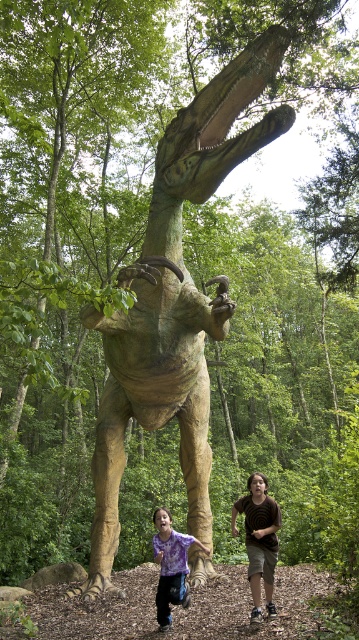
In the scene shown: Which is more to the right, green textured dinosaur at center or brown cotton shirt at lower center?

From the viewer's perspective, brown cotton shirt at lower center appears more on the right side.

The height and width of the screenshot is (640, 359). What do you see at coordinates (174, 301) in the screenshot?
I see `green textured dinosaur at center` at bounding box center [174, 301].

Does point (113, 403) come farther from viewer compared to point (259, 483)?

Yes, it is.

This screenshot has height=640, width=359. Find the location of `green textured dinosaur at center`. green textured dinosaur at center is located at coordinates (174, 301).

Between point (216, 163) and point (152, 520), which one is positioned behind?

Positioned behind is point (152, 520).

Does green textured dinosaur at center have a greater height compared to purple tie-dye shirt at lower center?

Yes, green textured dinosaur at center is taller than purple tie-dye shirt at lower center.

Is point (164, 141) more distant than point (169, 611)?

Yes.

Where is `green textured dinosaur at center`? green textured dinosaur at center is located at coordinates (174, 301).

Between point (257, 509) and point (179, 561), which one is positioned in front?

Positioned in front is point (257, 509).

Is brown cotton shirt at lower center below purple tie-dye shirt at lower center?

Incorrect, brown cotton shirt at lower center is not positioned below purple tie-dye shirt at lower center.

Between point (240, 502) and point (188, 600), which one is positioned in front?

Point (188, 600)

The image size is (359, 640). Identify the location of brown cotton shirt at lower center. (258, 540).